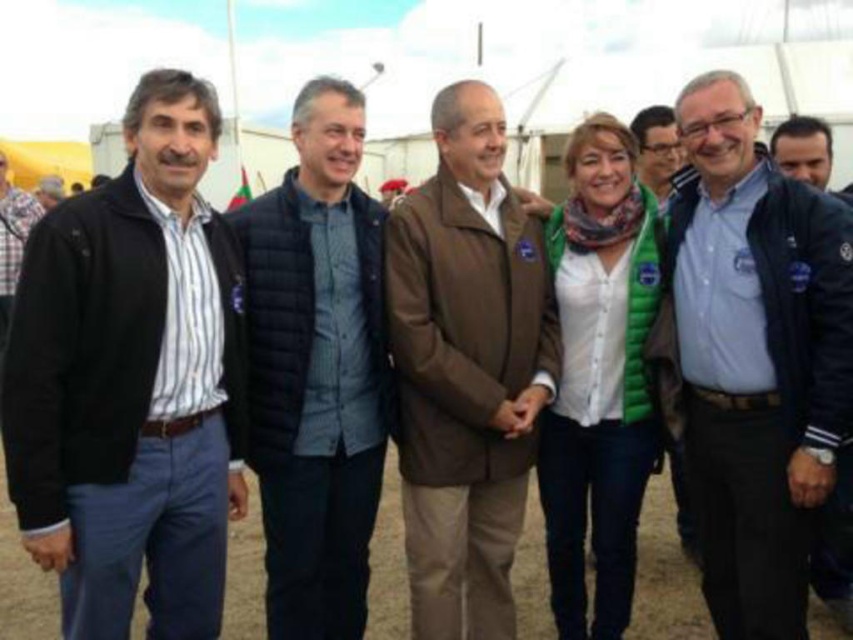
Is matte black jacket at left below brown leather jacket at center?

No, matte black jacket at left is not below brown leather jacket at center.

Which is in front, point (146, 288) or point (407, 428)?

Positioned in front is point (146, 288).

Locate an element on the screen. This screenshot has width=853, height=640. matte black jacket at left is located at coordinates (131, 381).

Which is more to the right, brown leather jacket at center or matte black jacket at upper center?

From the viewer's perspective, matte black jacket at upper center appears more on the right side.

Which is in front, point (399, 282) or point (653, 150)?

Positioned in front is point (399, 282).

The height and width of the screenshot is (640, 853). I want to click on brown leather jacket at center, so click(466, 369).

Looking at this image, is matte black jacket at left shorter than blue fabric shirt at center?

Yes, matte black jacket at left is shorter than blue fabric shirt at center.

Between matte black jacket at left and blue fabric shirt at center, which one is positioned lower?

matte black jacket at left

Is point (142, 141) closer to camera compared to point (740, 170)?

Yes, point (142, 141) is in front of point (740, 170).

Locate an element on the screen. This screenshot has width=853, height=640. matte black jacket at left is located at coordinates (131, 381).